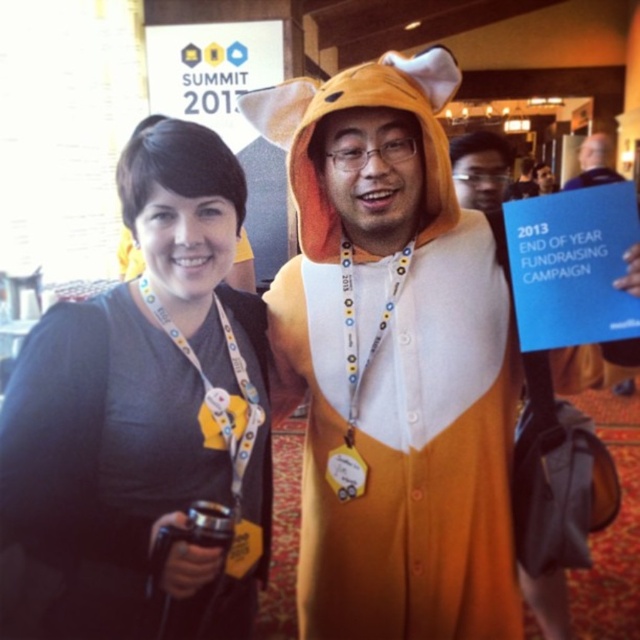
In the scene shown: Who is taller, orange plush onesie at center or black fabric shirt at center?

Standing taller between the two is orange plush onesie at center.

Measure the distance between orange plush onesie at center and black fabric shirt at center.

orange plush onesie at center and black fabric shirt at center are 30.58 centimeters apart.

Between point (442, 372) and point (26, 461), which one is positioned behind?

Point (442, 372)

At what (x,y) coordinates should I click in order to perform the action: click on orange plush onesie at center. Please return your answer as a coordinate pair (x, y). Looking at the image, I should click on (392, 360).

Where is `black fabric shirt at center`? Image resolution: width=640 pixels, height=640 pixels. black fabric shirt at center is located at coordinates click(x=141, y=417).

Can you confirm if black fabric shirt at center is positioned above blue fabric shirt at upper right?

No.

The width and height of the screenshot is (640, 640). In order to click on black fabric shirt at center in this screenshot , I will do `click(141, 417)`.

This screenshot has height=640, width=640. Identify the location of orange plush onesie at center. pyautogui.click(x=392, y=360).

Which of these two, orange plush onesie at center or blue fabric shirt at upper right, stands shorter?

With less height is blue fabric shirt at upper right.

Identify the location of orange plush onesie at center. The height and width of the screenshot is (640, 640). (392, 360).

At what (x,y) coordinates should I click in order to perform the action: click on orange plush onesie at center. Please return your answer as a coordinate pair (x, y). This screenshot has height=640, width=640. Looking at the image, I should click on (392, 360).